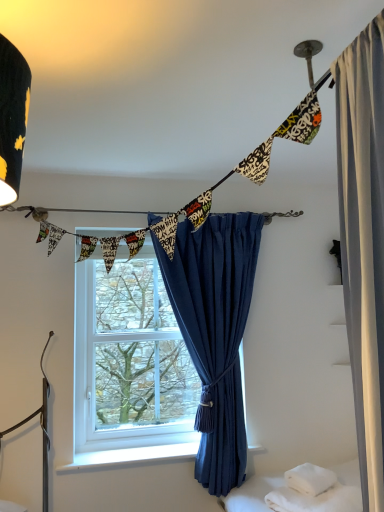
Question: Considering the positions of printed fabric bunting at upper center and white soft towel at lower right in the image, is printed fabric bunting at upper center bigger or smaller than white soft towel at lower right?

Choices:
 (A) small
 (B) big

Answer: (B)

Question: In terms of height, does printed fabric bunting at upper center look taller or shorter compared to white soft towel at lower right?

Choices:
 (A) tall
 (B) short

Answer: (A)

Question: Which is farther from the blue velvet curtain at center?

Choices:
 (A) clear glass window at center
 (B) printed fabric bunting at upper center
 (C) white soft pillow at lower right
 (D) white smooth window sill at lower center
 (E) white soft towel at lower right

Answer: (B)

Question: Which object is positioned farthest from the clear glass window at center?

Choices:
 (A) white smooth window sill at lower center
 (B) white soft pillow at lower right
 (C) blue velvet curtain at center
 (D) printed fabric bunting at upper center
 (E) white soft towel at lower right

Answer: (B)